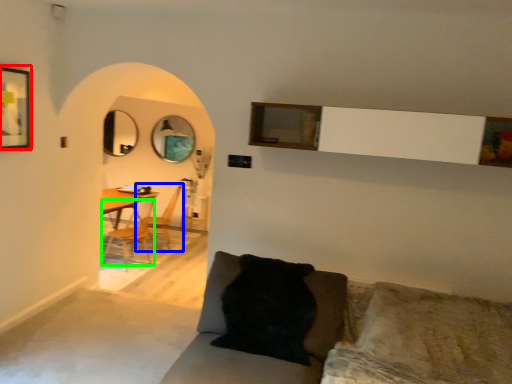
Question: Considering the real-world distances, which object is farthest from picture frame (highlighted by a red box)? armchair (highlighted by a blue box) or chair (highlighted by a green box)?

Choices:
 (A) armchair
 (B) chair

Answer: (A)